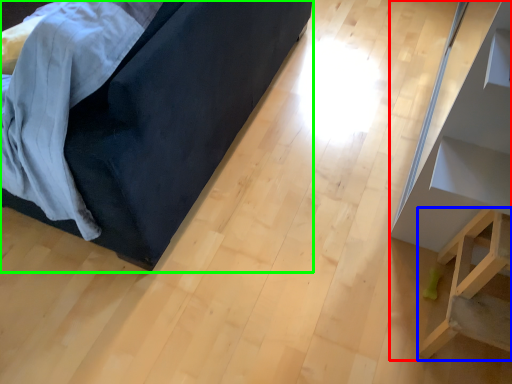
Question: Which object is positioned farthest from furniture (highlighted by a red box)? Select from furniture (highlighted by a blue box) and furniture (highlighted by a green box).

Choices:
 (A) furniture
 (B) furniture

Answer: (B)